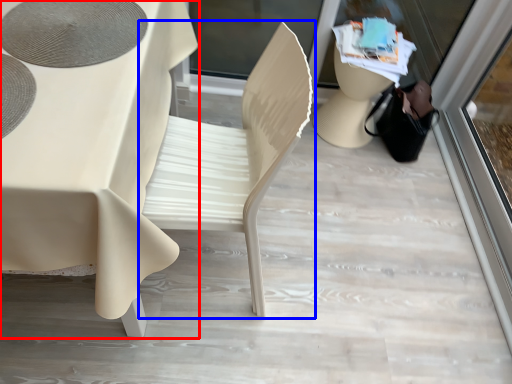
Question: Which object is further to the camera taking this photo, table (highlighted by a red box) or chair (highlighted by a blue box)?

Choices:
 (A) table
 (B) chair

Answer: (B)